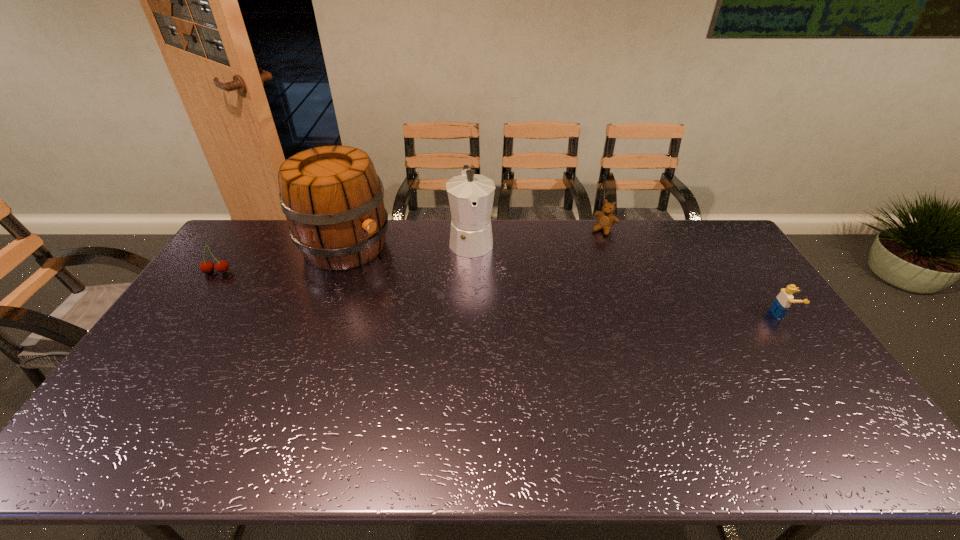
Locate an element on the screen. The width and height of the screenshot is (960, 540). object that is at the right edge is located at coordinates (783, 301).

The image size is (960, 540). Find the location of `vacant space at the far edge of the desktop`. vacant space at the far edge of the desktop is located at coordinates (547, 252).

Locate an element on the screen. The height and width of the screenshot is (540, 960). vacant region at the near edge of the desktop is located at coordinates (541, 402).

Where is `vacant space at the left edge of the desktop`? The image size is (960, 540). vacant space at the left edge of the desktop is located at coordinates (190, 356).

This screenshot has width=960, height=540. In the image, there is a desktop. In order to click on vacant space at the right edge in this screenshot , I will do `click(762, 359)`.

Where is `free space between the cherry and the second object from left to right`? free space between the cherry and the second object from left to right is located at coordinates (281, 259).

The height and width of the screenshot is (540, 960). In order to click on vacant area that lies between the fourth object from left to right and the nearest object in this screenshot , I will do `click(693, 272)`.

Locate an element on the screen. unoccupied area between the Lego and the fourth object from left to right is located at coordinates (693, 272).

Locate an element on the screen. Image resolution: width=960 pixels, height=540 pixels. empty location between the teddy bear and the nearest object is located at coordinates (693, 272).

Locate an element on the screen. This screenshot has height=540, width=960. vacant area that lies between the rightmost object and the third object from left to right is located at coordinates (627, 277).